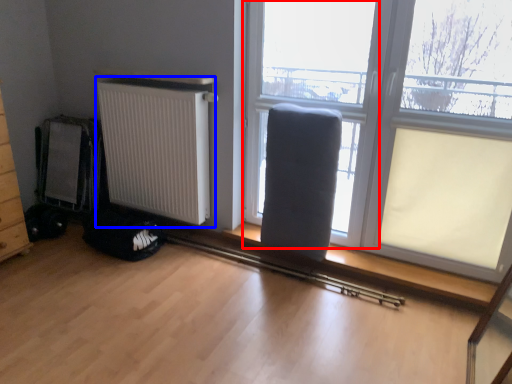
Question: Which object appears closest to the camera in this image, window frame (highlighted by a red box) or radiator (highlighted by a blue box)?

Choices:
 (A) window frame
 (B) radiator

Answer: (A)